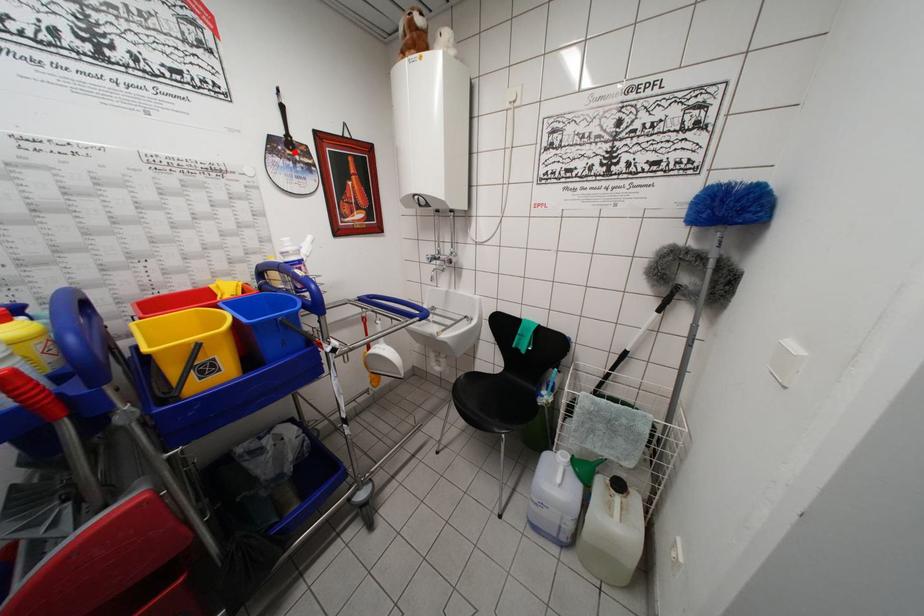
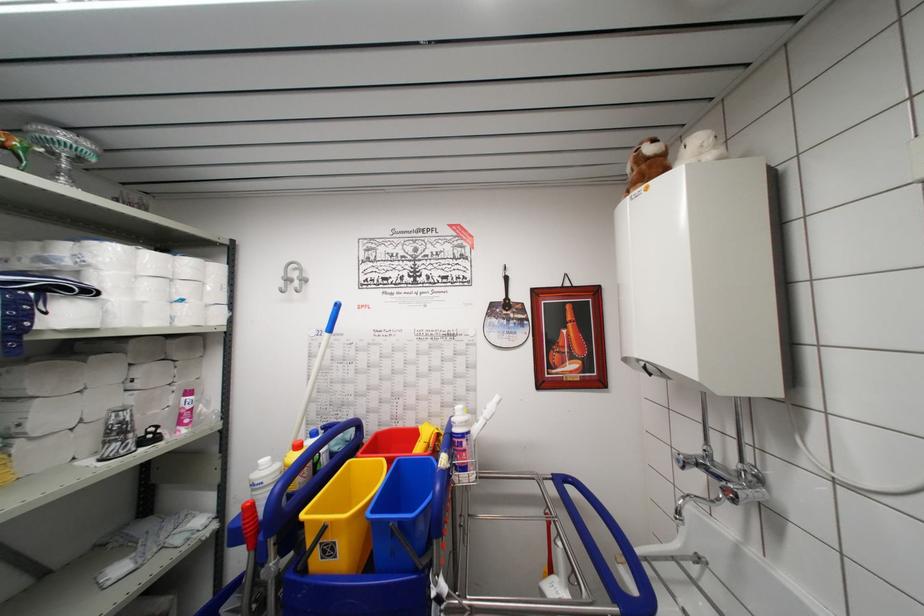
Find the pixel in the second image that matches the highlighted location in the first image.

(511, 313)